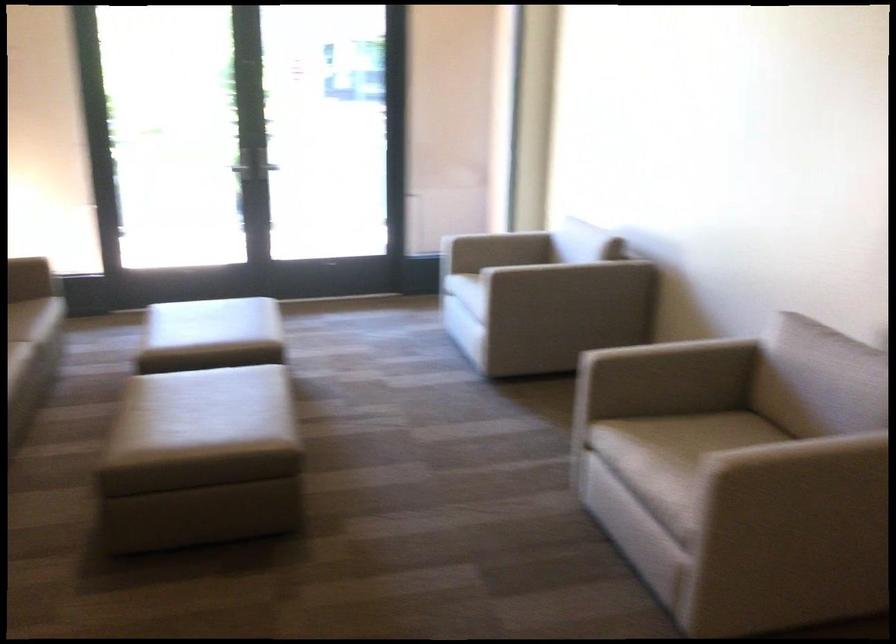
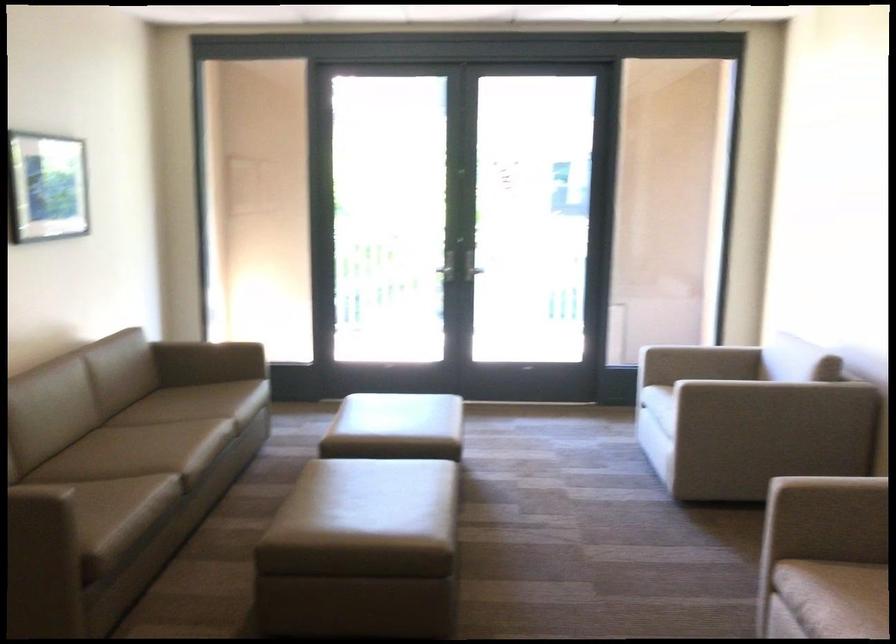
Find the pixel in the second image that matches the point at 648,436 in the first image.

(856, 591)